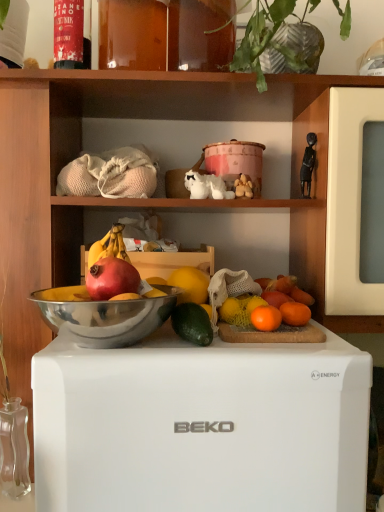
Where is `free space to the left of orange matte grapefruit at upper right, the 2th grapefruit in the right-to-left sequence`? The width and height of the screenshot is (384, 512). free space to the left of orange matte grapefruit at upper right, the 2th grapefruit in the right-to-left sequence is located at coordinates (193, 339).